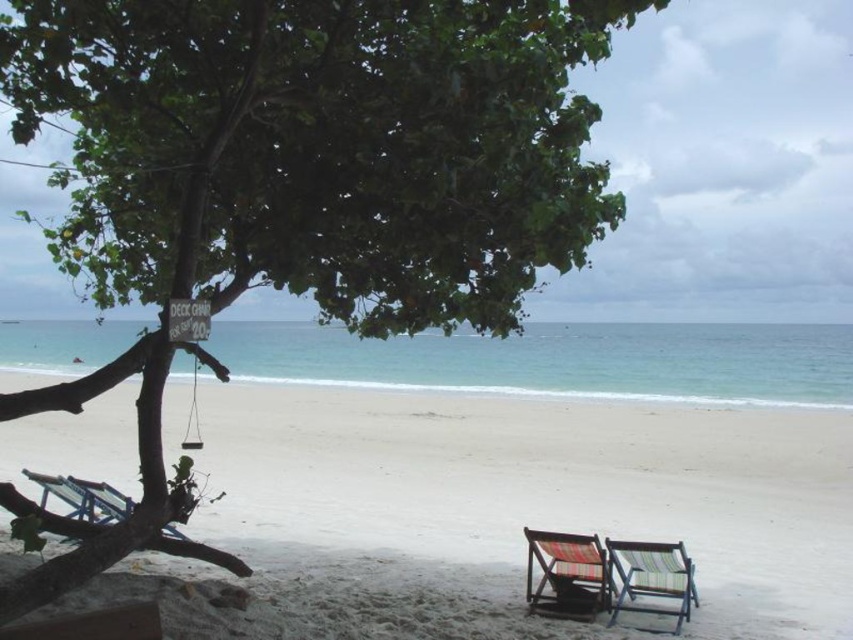
Is white sandy beach at center wider than wooden deck chair at left?

Yes, white sandy beach at center is wider than wooden deck chair at left.

Can you confirm if white sandy beach at center is taller than wooden deck chair at left?

Indeed, white sandy beach at center has a greater height compared to wooden deck chair at left.

Identify the location of white sandy beach at center. (538, 490).

Between plaid fabric beach chair at lower right and wooden deck chair at left, which one is positioned lower?

plaid fabric beach chair at lower right is below.

Does point (538, 593) lie in front of point (94, 483)?

Yes, it is.

Image resolution: width=853 pixels, height=640 pixels. Find the location of `plaid fabric beach chair at lower right`. plaid fabric beach chair at lower right is located at coordinates (566, 573).

Which of these two, white sandy beach at center or striped fabric beach chair at lower right, stands taller?

white sandy beach at center is taller.

At what (x,y) coordinates should I click in order to perform the action: click on white sandy beach at center. Please return your answer as a coordinate pair (x, y). This screenshot has width=853, height=640. Looking at the image, I should click on (538, 490).